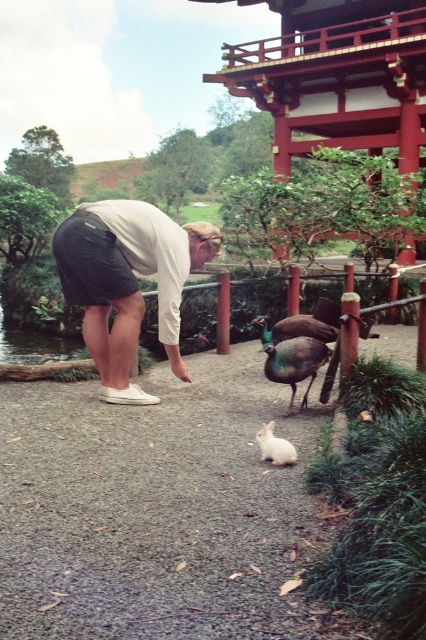
Question: Is white cotton shirt at center bigger than white fluffy rabbit at lower center?

Choices:
 (A) yes
 (B) no

Answer: (A)

Question: Among these objects, which one is nearest to the camera?

Choices:
 (A) white cotton shirt at center
 (B) white fluffy rabbit at lower center
 (C) green iridescent feathers at center

Answer: (B)

Question: Which object is the farthest from the white cotton shirt at center?

Choices:
 (A) green iridescent feathers at center
 (B) white fluffy rabbit at lower center

Answer: (B)

Question: Which of the following is the closest to the observer?

Choices:
 (A) (291, 452)
 (B) (134, 397)

Answer: (A)

Question: From the image, what is the correct spatial relationship of green iridescent feathers at center in relation to white fluffy rabbit at lower center?

Choices:
 (A) below
 (B) above

Answer: (B)

Question: Is white cotton shirt at center bigger than white fluffy rabbit at lower center?

Choices:
 (A) no
 (B) yes

Answer: (B)